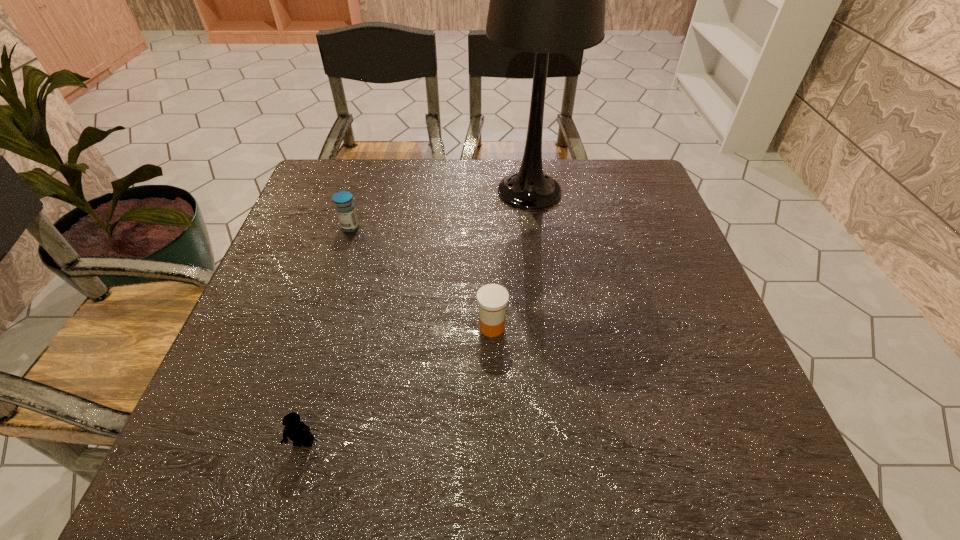
I want to click on the farthest object, so click(544, 0).

You are a GUI agent. You are given a task and a screenshot of the screen. Output one action in this format:
    pyautogui.click(x=<x>, y=<y>)
    Task: Click on the tallest object
    
    Given the screenshot: What is the action you would take?
    pyautogui.click(x=544, y=0)

Where is `the nearer medicine`? the nearer medicine is located at coordinates (492, 298).

Locate an element on the screen. the second nearest object is located at coordinates (492, 298).

In order to click on the third nearest object in this screenshot , I will do `click(345, 208)`.

This screenshot has height=540, width=960. I want to click on the farther medicine, so point(345,208).

Where is `the nearest object`? Image resolution: width=960 pixels, height=540 pixels. the nearest object is located at coordinates (296, 430).

Identify the location of Lego. (296, 430).

In order to click on free spot located on the right of the tallest object in this screenshot , I will do `click(596, 192)`.

This screenshot has height=540, width=960. Find the location of `vacant area located 0.190m on the label of the nearer medicine`. vacant area located 0.190m on the label of the nearer medicine is located at coordinates (384, 327).